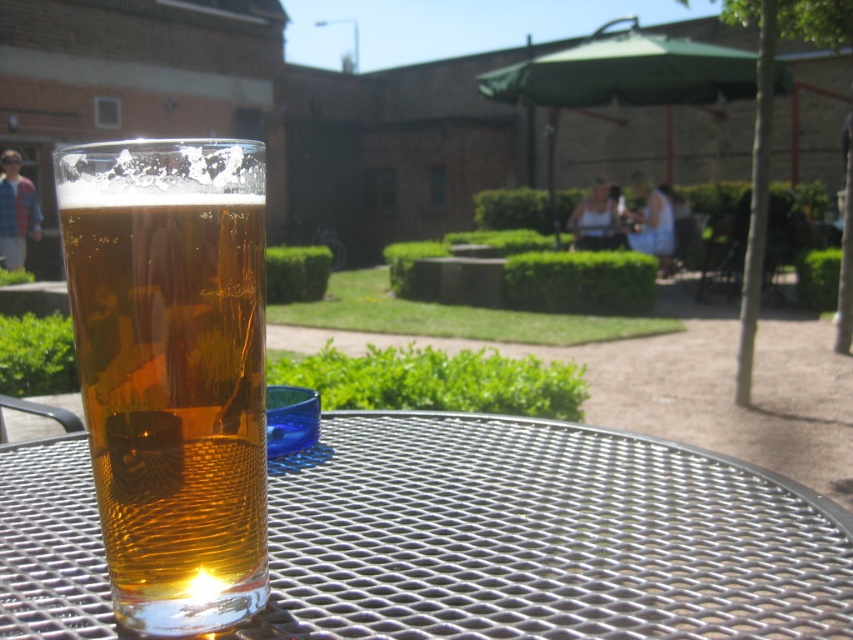
Question: Which point is farther from the camera taking this photo?

Choices:
 (A) (120, 477)
 (B) (535, 480)

Answer: (B)

Question: Which object is closer to the camera taking this photo?

Choices:
 (A) metallic silver table at center
 (B) translucent amber glass at center

Answer: (B)

Question: Considering the relative positions of metallic silver table at center and translucent amber glass at center in the image provided, where is metallic silver table at center located with respect to translucent amber glass at center?

Choices:
 (A) left
 (B) right

Answer: (B)

Question: From the image, what is the correct spatial relationship of metallic silver table at center in relation to translucent amber glass at center?

Choices:
 (A) right
 (B) left

Answer: (A)

Question: Is metallic silver table at center positioned in front of translucent amber glass at center?

Choices:
 (A) yes
 (B) no

Answer: (B)